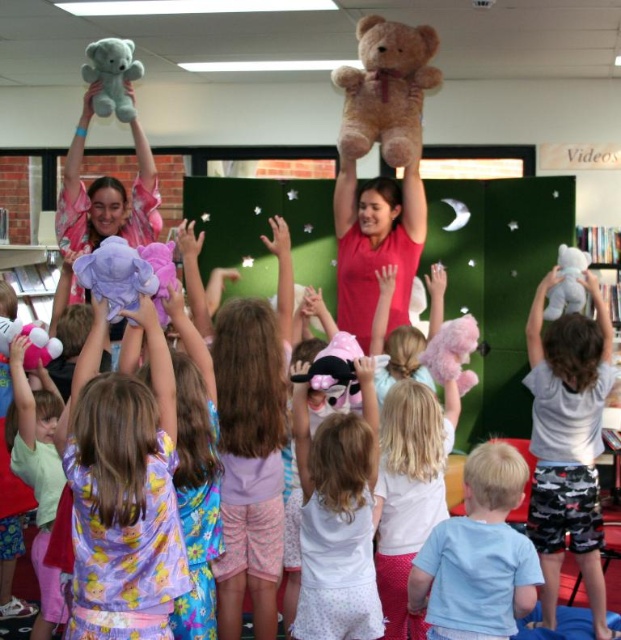
Question: Which object is farther from the camera taking this photo?

Choices:
 (A) white cotton shirt at upper center
 (B) matte pink shirt at center
 (C) soft brown teddy bear at upper center
 (D) fuzzy pink teddy bear at center

Answer: (B)

Question: Is white polka dot dress at center above matte pink shirt at center?

Choices:
 (A) yes
 (B) no

Answer: (B)

Question: Is white polka dot dress at center thinner than fuzzy pink teddy bear at center?

Choices:
 (A) yes
 (B) no

Answer: (B)

Question: Based on their relative distances, which object is nearer to the white plush teddy bear at upper right?

Choices:
 (A) white polka dot dress at center
 (B) soft brown teddy bear at upper center
 (C) light blue cotton shirt at lower right
 (D) matte pink shirt at center

Answer: (D)

Question: Which of the following is the farthest from the observer?

Choices:
 (A) (107, 97)
 (B) (170, 365)
 (C) (355, 260)
 (D) (406, 435)

Answer: (C)

Question: Is the position of matte pink shirt at center less distant than that of pink plush bear at upper left?

Choices:
 (A) no
 (B) yes

Answer: (A)